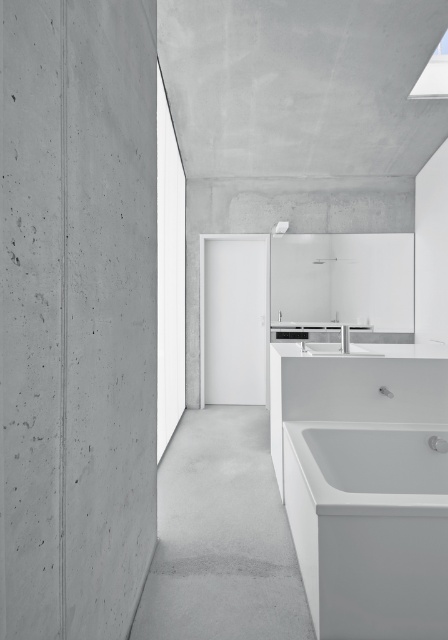
Question: Does white glossy bathtub at lower right have a smaller size compared to gray concrete floor at center?

Choices:
 (A) yes
 (B) no

Answer: (B)

Question: Does white glossy bathtub at lower right appear on the left side of gray concrete floor at center?

Choices:
 (A) no
 (B) yes

Answer: (A)

Question: Estimate the real-world distances between objects in this image. Which object is farther from the gray concrete floor at center?

Choices:
 (A) white glossy bathtub at lower right
 (B) white glossy sink at center

Answer: (B)

Question: Which object is positioned closest to the white glossy bathtub at lower right?

Choices:
 (A) gray concrete floor at center
 (B) white glossy sink at center

Answer: (A)

Question: Which of these objects is positioned closest to the white glossy bathtub at lower right?

Choices:
 (A) gray concrete floor at center
 (B) white glossy sink at center

Answer: (A)

Question: Is gray concrete floor at center positioned before white glossy sink at center?

Choices:
 (A) yes
 (B) no

Answer: (A)